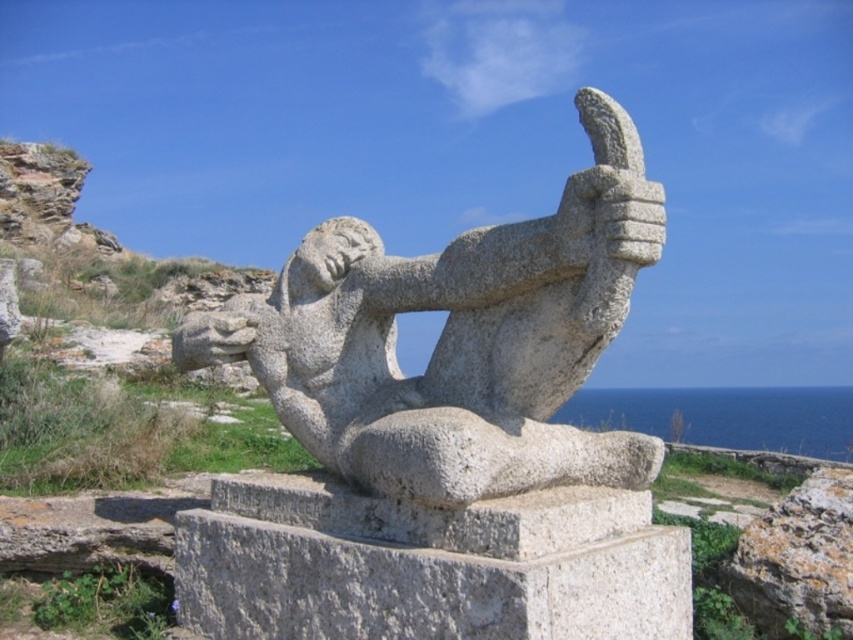
You are a photographer planning to capture the granite statue at center and the granite rock at lower right in a single frame. Given that the statue is much taller than the rock, how should you position your camera to ensure both are fully visible in the photo?

To capture both the granite statue at center and the granite rock at lower right in a single frame, position the camera at a lower angle to include the full height of the statue while still framing the smaller granite rock at lower right within the shot.

You are a photographer planning to take a photo of the granite statue at center and the granite rock at lower right. To ensure both are fully visible in the frame, which one should you position closer to the camera?

The granite statue at center should be positioned closer to the camera since it is in front of the granite rock at lower right, meaning it is already nearer to the viewer.